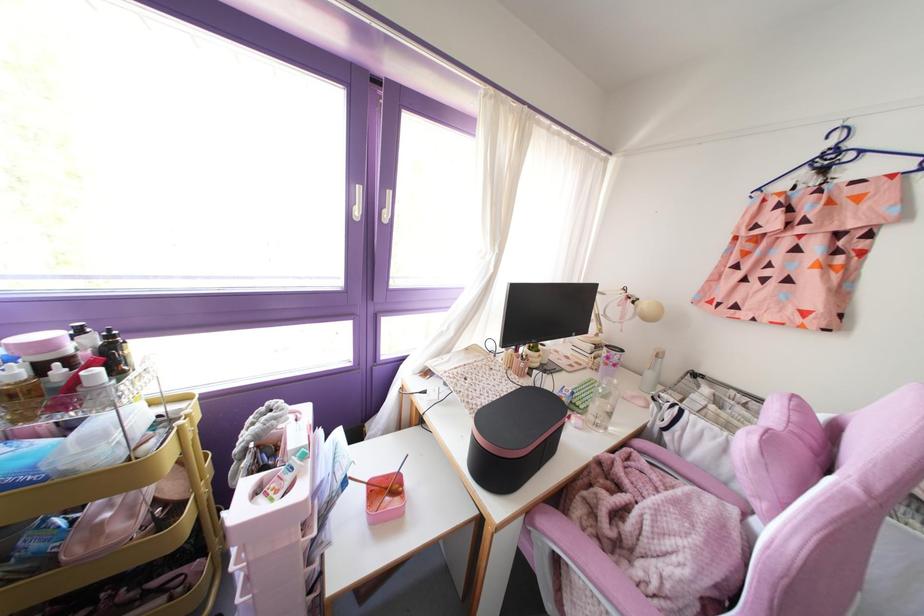
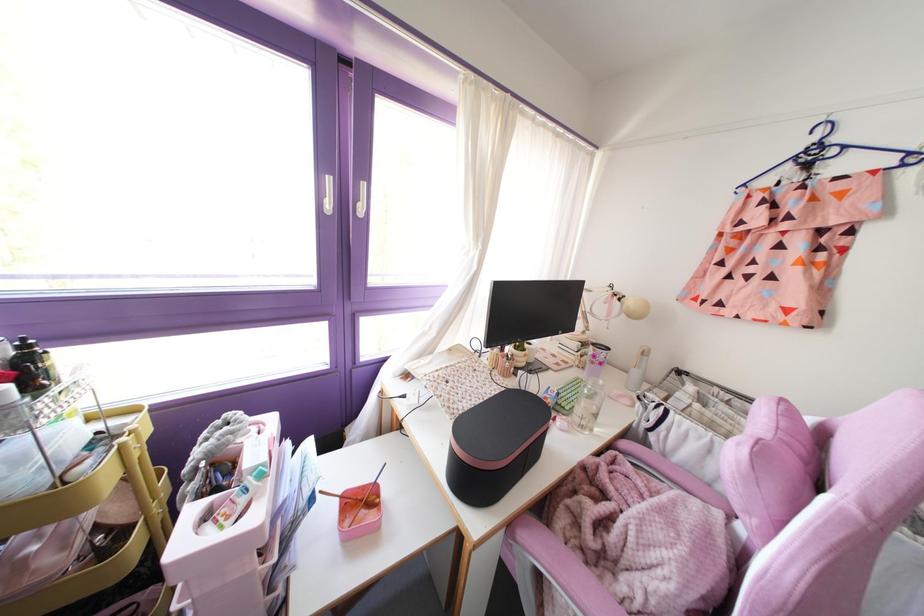
Locate, in the second image, the point that corresponds to (614,381) in the first image.

(601, 382)